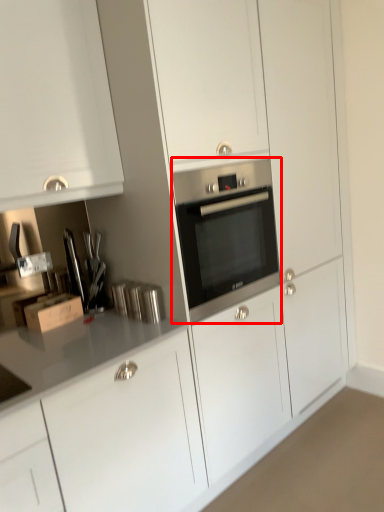
Question: From the image's perspective, where is home appliance (annotated by the red box) located relative to cardboard box?

Choices:
 (A) below
 (B) above

Answer: (B)